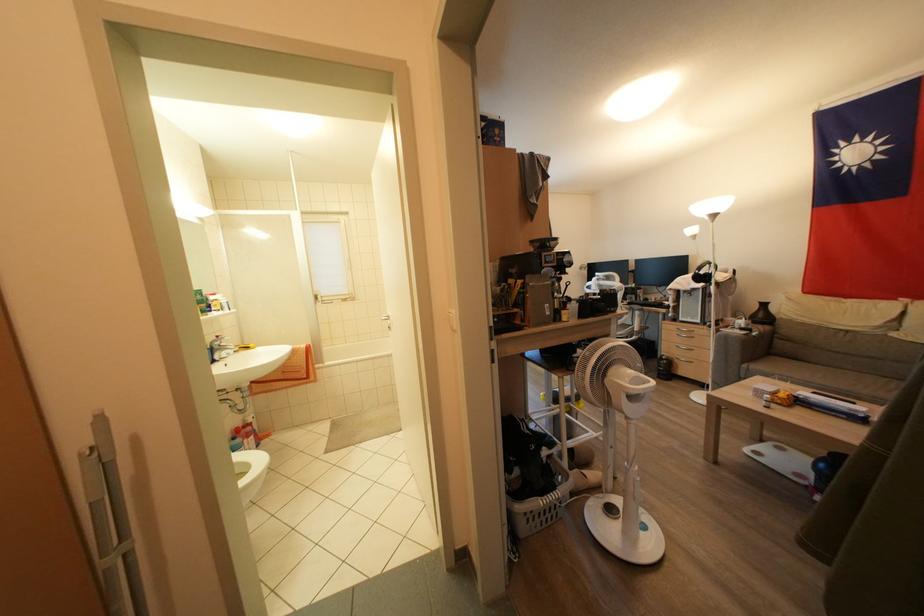
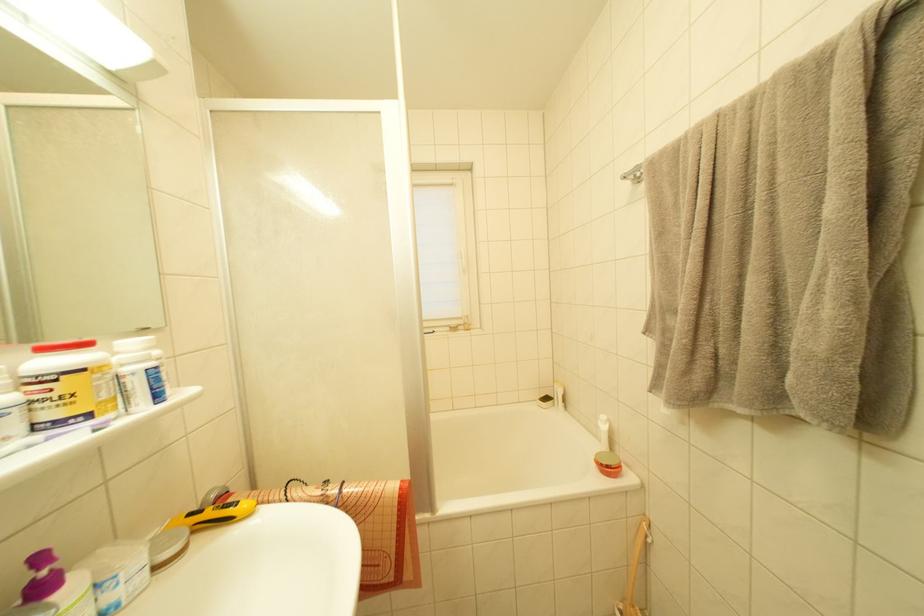
Find the pixel in the second image that matches the point at 317,382 in the first image.

(411, 577)